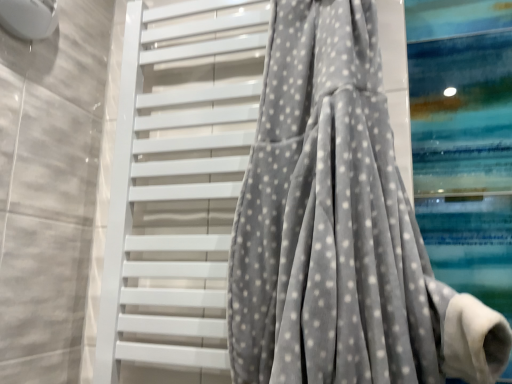
Question: Considering the relative sizes of white matte towel rack at center and gray velvety curtain at center in the image provided, is white matte towel rack at center wider than gray velvety curtain at center?

Choices:
 (A) no
 (B) yes

Answer: (A)

Question: Can you confirm if white matte towel rack at center is bigger than gray velvety curtain at center?

Choices:
 (A) yes
 (B) no

Answer: (B)

Question: From the image's perspective, is white matte towel rack at center beneath gray velvety curtain at center?

Choices:
 (A) yes
 (B) no

Answer: (A)

Question: Considering the relative positions of white matte towel rack at center and gray velvety curtain at center in the image provided, is white matte towel rack at center to the right of gray velvety curtain at center from the viewer's perspective?

Choices:
 (A) yes
 (B) no

Answer: (B)

Question: Is white matte towel rack at center oriented towards gray velvety curtain at center?

Choices:
 (A) no
 (B) yes

Answer: (B)

Question: From the image's perspective, is white matte towel rack at center above gray velvety curtain at center?

Choices:
 (A) no
 (B) yes

Answer: (A)

Question: Can you confirm if gray velvety curtain at center is wider than white matte towel rack at center?

Choices:
 (A) yes
 (B) no

Answer: (A)

Question: Does gray velvety curtain at center turn towards white matte towel rack at center?

Choices:
 (A) yes
 (B) no

Answer: (B)

Question: Can you confirm if gray velvety curtain at center is taller than white matte towel rack at center?

Choices:
 (A) yes
 (B) no

Answer: (B)

Question: From a real-world perspective, does gray velvety curtain at center stand above white matte towel rack at center?

Choices:
 (A) no
 (B) yes

Answer: (A)

Question: Is white matte towel rack at center completely or partially inside gray velvety curtain at center?

Choices:
 (A) no
 (B) yes

Answer: (A)

Question: From the image's perspective, does gray velvety curtain at center appear lower than white matte towel rack at center?

Choices:
 (A) no
 (B) yes

Answer: (A)

Question: Considering their positions, is gray velvety curtain at center located in front of or behind white matte towel rack at center?

Choices:
 (A) behind
 (B) front

Answer: (B)